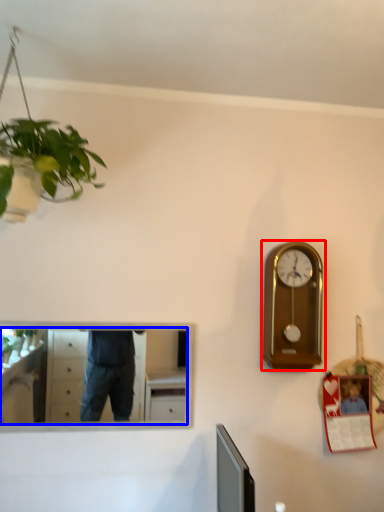
Question: Which object is closer to the camera taking this photo, wall clock (highlighted by a red box) or mirror (highlighted by a blue box)?

Choices:
 (A) wall clock
 (B) mirror

Answer: (B)